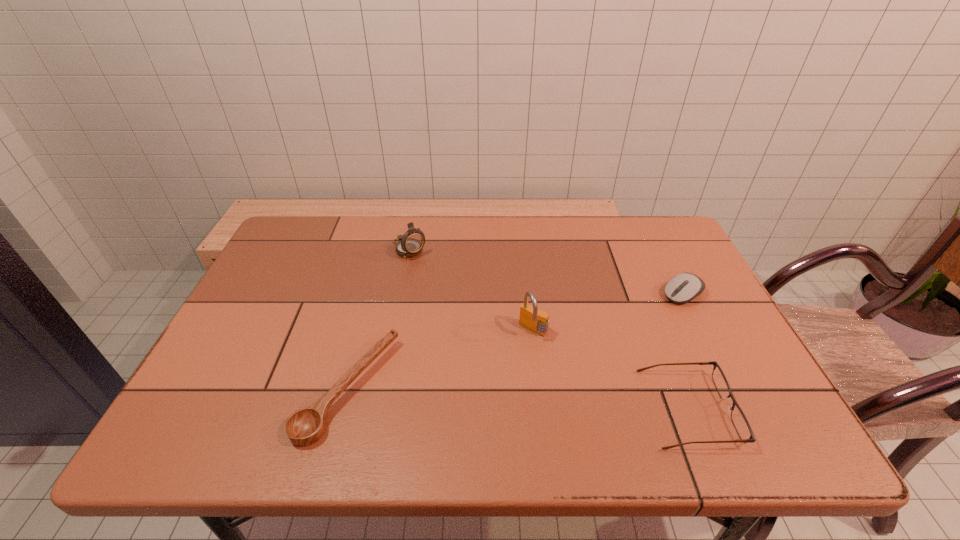
The height and width of the screenshot is (540, 960). I want to click on vacant space located on the face of the farthest object, so click(495, 338).

Locate an element on the screen. This screenshot has width=960, height=540. free spot located 0.350m on the face of the farthest object is located at coordinates (488, 330).

Locate an element on the screen. The image size is (960, 540). vacant space located 0.320m on the face of the farthest object is located at coordinates (481, 323).

The width and height of the screenshot is (960, 540). What are the coordinates of `free space located 0.180m on the side with the combination dials of the third object from right to left` in the screenshot? It's located at (485, 389).

You are a GUI agent. You are given a task and a screenshot of the screen. Output one action in this format:
    pyautogui.click(x=<x>, y=<y>)
    Task: Click on the vacant space situated on the side with the combination dials of the third object from right to left
    This screenshot has height=540, width=960.
    Given the screenshot: What is the action you would take?
    pyautogui.click(x=514, y=354)

In order to click on free space located 0.100m on the side with the combination dials of the third object from right to left in this screenshot , I will do `click(504, 365)`.

You are a GUI agent. You are given a task and a screenshot of the screen. Output one action in this format:
    pyautogui.click(x=<x>, y=<y>)
    Task: Click on the object at the far edge
    This screenshot has height=540, width=960.
    Given the screenshot: What is the action you would take?
    pyautogui.click(x=411, y=243)

Find the location of `wooden spoon that is at the near edge`. wooden spoon that is at the near edge is located at coordinates (304, 427).

Locate an element on the screen. This screenshot has height=540, width=960. spectacles that is at the near edge is located at coordinates (740, 422).

Find the location of `spectacles at the right edge`. spectacles at the right edge is located at coordinates (740, 422).